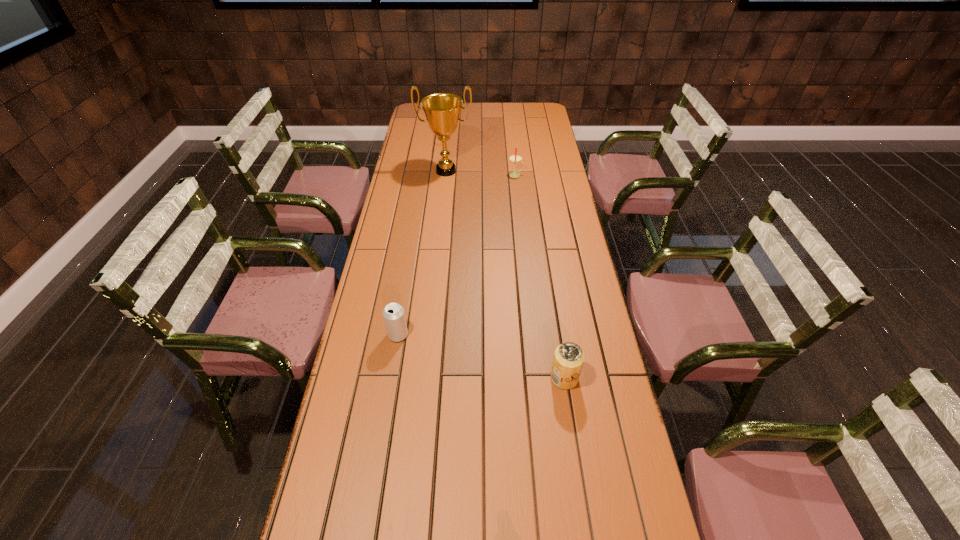
I want to click on the tallest object, so click(x=442, y=110).

This screenshot has width=960, height=540. I want to click on candle, so click(515, 158).

Locate an element on the screen. The height and width of the screenshot is (540, 960). the nearer beer can is located at coordinates [x=568, y=360].

I want to click on the rightmost object, so click(x=568, y=360).

At what (x,y) coordinates should I click in order to perform the action: click on the farther beer can. Please return your answer as a coordinate pair (x, y). Looking at the image, I should click on (394, 316).

The image size is (960, 540). In order to click on the left beer can in this screenshot , I will do `click(394, 316)`.

Find the location of a particular element. The width and height of the screenshot is (960, 540). blank space located on the front view with handles of the award is located at coordinates (440, 231).

Image resolution: width=960 pixels, height=540 pixels. I want to click on vacant position located 0.270m on the back of the second object from right to left, so click(x=513, y=142).

Locate an element on the screen. vacant space located on the front of the nearest object is located at coordinates (584, 505).

Where is `free point located on the right of the third farthest object`? free point located on the right of the third farthest object is located at coordinates (535, 335).